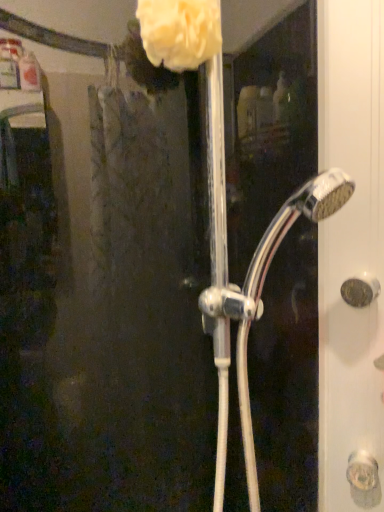
Question: Is chrome metallic showerhead at center at the right side of matte gold door handle at right?

Choices:
 (A) yes
 (B) no

Answer: (B)

Question: Is chrome metallic showerhead at center thinner than matte gold door handle at right?

Choices:
 (A) yes
 (B) no

Answer: (B)

Question: Is chrome metallic showerhead at center shorter than matte gold door handle at right?

Choices:
 (A) yes
 (B) no

Answer: (B)

Question: Can you confirm if chrome metallic showerhead at center is bigger than matte gold door handle at right?

Choices:
 (A) no
 (B) yes

Answer: (B)

Question: Would you consider chrome metallic showerhead at center to be distant from matte gold door handle at right?

Choices:
 (A) no
 (B) yes

Answer: (A)

Question: Is chrome metallic showerhead at center completely or partially outside of matte gold door handle at right?

Choices:
 (A) yes
 (B) no

Answer: (A)

Question: Is matte gold door handle at right turned away from white fluffy sponge at upper center?

Choices:
 (A) yes
 (B) no

Answer: (B)

Question: Is matte gold door handle at right to the left of white fluffy sponge at upper center from the viewer's perspective?

Choices:
 (A) yes
 (B) no

Answer: (B)

Question: Is matte gold door handle at right shorter than white fluffy sponge at upper center?

Choices:
 (A) no
 (B) yes

Answer: (B)

Question: From the image's perspective, is matte gold door handle at right located above white fluffy sponge at upper center?

Choices:
 (A) no
 (B) yes

Answer: (A)

Question: Considering the relative sizes of matte gold door handle at right and white fluffy sponge at upper center in the image provided, is matte gold door handle at right bigger than white fluffy sponge at upper center?

Choices:
 (A) yes
 (B) no

Answer: (B)

Question: Does matte gold door handle at right lie behind white fluffy sponge at upper center?

Choices:
 (A) no
 (B) yes

Answer: (B)

Question: Is white fluffy sponge at upper center next to chrome metallic showerhead at center and touching it?

Choices:
 (A) no
 (B) yes

Answer: (A)